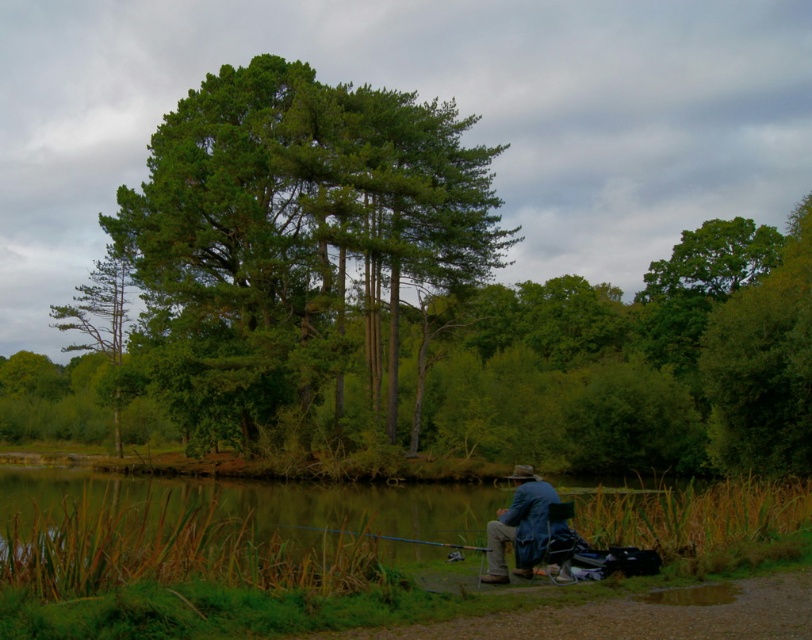
Consider the image. You are standing at the edge of the water and want to pick up the denim jacket at lower right. To reach it, you need to walk around the green rough bark tree at left. Which direction should you walk around the tree to get to the jacket?

The denim jacket at lower right is behind the green rough bark tree at left, so you should walk around the tree to the right side to reach the jacket.

You are planning to set up a small tent in the area shown in the image. The tent requires a flat space that is larger than the denim jacket at lower right. Can the green grassy water at lower left provide enough space for the tent?

The green grassy water at lower left has a larger size compared to the denim jacket at lower right. Therefore, the green grassy water at lower left can provide enough space for the tent since it is larger than the required size.

You are a photographer planning to capture a wide shot of the green rough bark tree at left and the denim jacket at lower right. Considering their sizes, which object will occupy more space in the photo?

The green rough bark tree at left will occupy more space in the photo since its width surpasses that of the denim jacket at lower right according to the description.